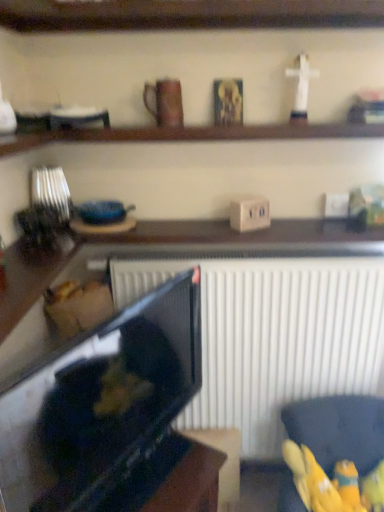
Question: Is yellow fabric toy at lower right, which is the 4th toy from left to right, at the right side of wooden figurine at upper right, placed as the 3th toy when sorted from left to right?

Choices:
 (A) yes
 (B) no

Answer: (A)

Question: Does yellow fabric toy at lower right, the first toy viewed from the right, appear on the left side of wooden figurine at upper right, the second toy positioned from the top?

Choices:
 (A) yes
 (B) no

Answer: (B)

Question: Is yellow fabric toy at lower right, which is the 4th toy from left to right, surrounding wooden figurine at upper right, the second toy positioned from the top?

Choices:
 (A) no
 (B) yes

Answer: (A)

Question: Are yellow fabric toy at lower right, the first toy viewed from the right, and wooden figurine at upper right, placed as the 3th toy when sorted from left to right, far apart?

Choices:
 (A) no
 (B) yes

Answer: (B)

Question: Considering the relative sizes of yellow fabric toy at lower right, which is the 4th toy from left to right, and wooden figurine at upper right, the 2th toy in the right-to-left sequence, in the image provided, is yellow fabric toy at lower right, which is the 4th toy from left to right, wider than wooden figurine at upper right, the 2th toy in the right-to-left sequence,?

Choices:
 (A) yes
 (B) no

Answer: (B)

Question: Does yellow fabric toy at lower right, the first toy viewed from the right, turn towards wooden figurine at upper right, the 2th toy in the right-to-left sequence?

Choices:
 (A) yes
 (B) no

Answer: (B)

Question: Is wooden figurine at upper right, the 3th toy in the bottom-to-top sequence, positioned behind wooden shelf at upper center, which is counted as the first shelf, starting from the top?

Choices:
 (A) no
 (B) yes

Answer: (B)

Question: Does wooden figurine at upper right, the 3th toy in the bottom-to-top sequence, turn towards wooden shelf at upper center, the 2th shelf in the bottom-to-top sequence?

Choices:
 (A) no
 (B) yes

Answer: (A)

Question: Considering the relative sizes of wooden figurine at upper right, placed as the 3th toy when sorted from left to right, and wooden shelf at upper center, the 2th shelf in the bottom-to-top sequence, in the image provided, is wooden figurine at upper right, placed as the 3th toy when sorted from left to right, bigger than wooden shelf at upper center, the 2th shelf in the bottom-to-top sequence,?

Choices:
 (A) no
 (B) yes

Answer: (A)

Question: Is wooden figurine at upper right, the 3th toy in the bottom-to-top sequence, in front of wooden shelf at upper center, the 2th shelf in the bottom-to-top sequence?

Choices:
 (A) no
 (B) yes

Answer: (A)

Question: From the image's perspective, is wooden figurine at upper right, the second toy positioned from the top, on wooden shelf at upper center, which is counted as the first shelf, starting from the top?

Choices:
 (A) yes
 (B) no

Answer: (B)

Question: Is wooden figurine at upper right, the second toy positioned from the top, wider than wooden shelf at upper center, which is counted as the first shelf, starting from the top?

Choices:
 (A) no
 (B) yes

Answer: (A)

Question: Can you confirm if brown matte mug at upper center is taller than wooden figurine at upper right, placed as the 3th toy when sorted from left to right?

Choices:
 (A) no
 (B) yes

Answer: (B)